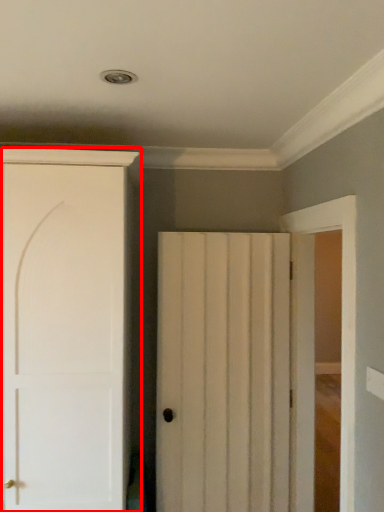
Question: From the image's perspective, where is door (annotated by the red box) located relative to door?

Choices:
 (A) below
 (B) above

Answer: (B)